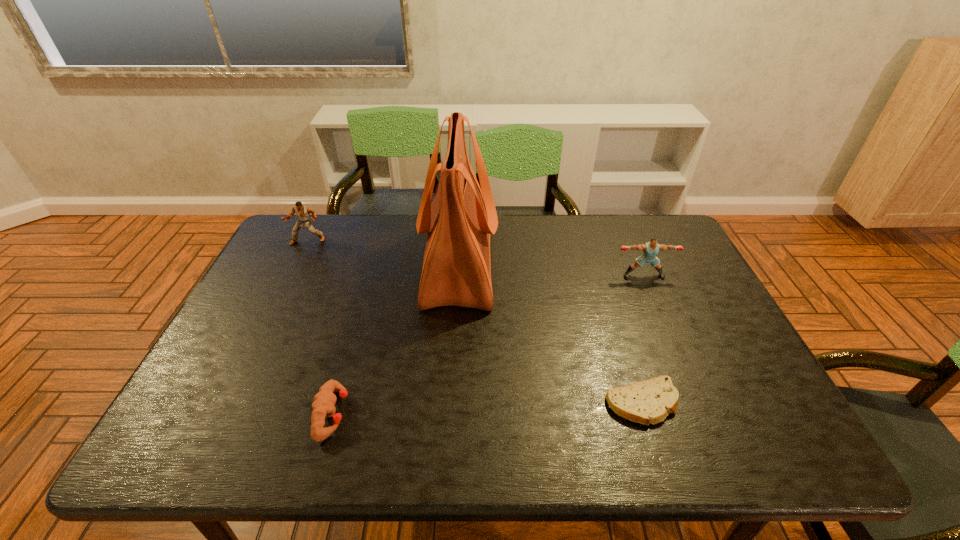
Identify the location of the tallest object. The width and height of the screenshot is (960, 540). (456, 271).

In order to click on the third object from right to left in this screenshot , I will do `click(456, 271)`.

Locate an element on the screen. The height and width of the screenshot is (540, 960). the leftmost object is located at coordinates (303, 212).

At what (x,y) coordinates should I click in order to perform the action: click on the farthest puncher. Please return your answer as a coordinate pair (x, y). Looking at the image, I should click on (303, 212).

This screenshot has height=540, width=960. I want to click on the second farthest puncher, so click(x=650, y=249).

Locate an element on the screen. This screenshot has width=960, height=540. the shortest puncher is located at coordinates (323, 406).

What are the coordinates of `the second puncher from left to right` in the screenshot? It's located at (x=323, y=406).

Where is `pita bread`? This screenshot has width=960, height=540. pita bread is located at coordinates (649, 401).

You are a GUI agent. You are given a task and a screenshot of the screen. Output one action in this format:
    pyautogui.click(x=<x>, y=<y>)
    Task: Click on the vacant space situated on the front pocket of the third object from right to left
    This screenshot has height=540, width=960.
    Given the screenshot: What is the action you would take?
    pyautogui.click(x=578, y=264)

This screenshot has width=960, height=540. Identify the location of vacant region located on the front-facing side of the leftmost puncher. (285, 286).